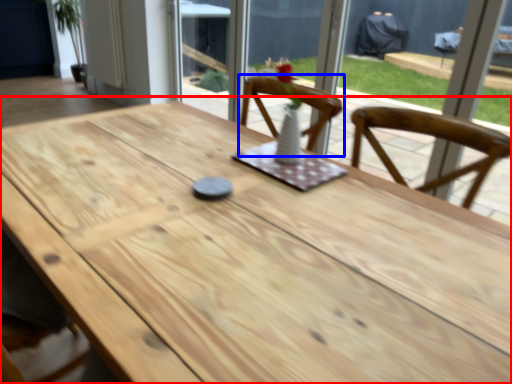
Question: Which of the following is the closest to the observer, table (highlighted by a red box) or chair (highlighted by a blue box)?

Choices:
 (A) table
 (B) chair

Answer: (A)